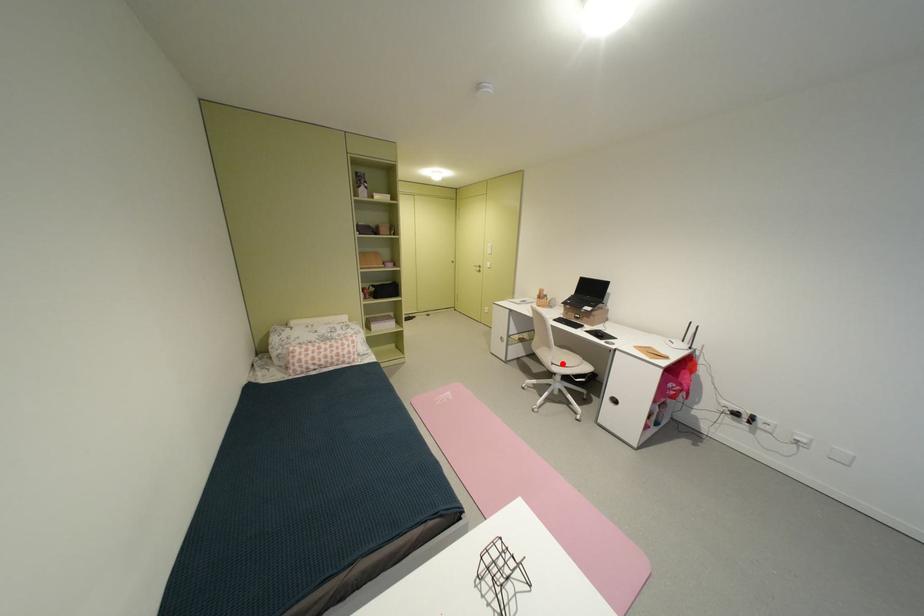
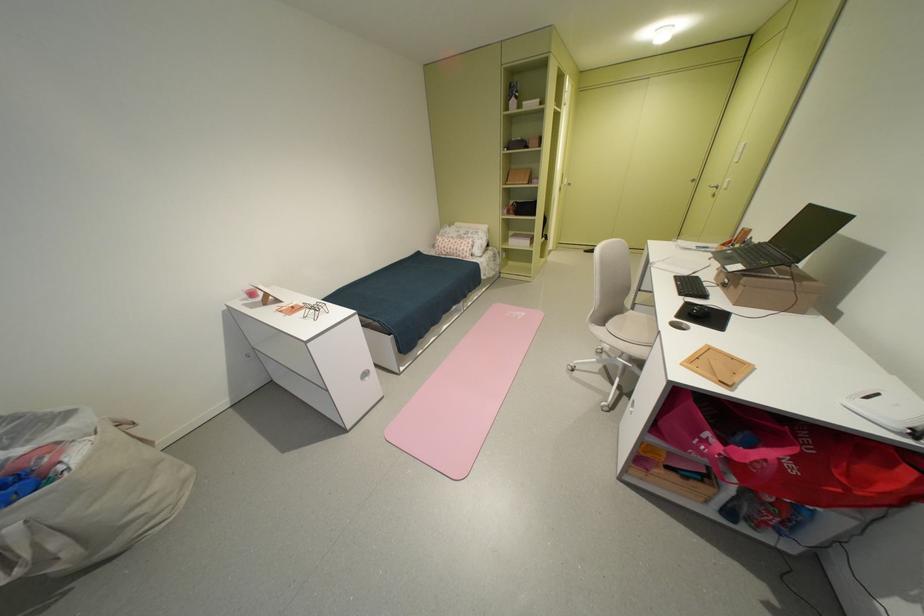
The point at the highlighted location is marked in the first image. Where is the corresponding point in the second image?

(615, 326)